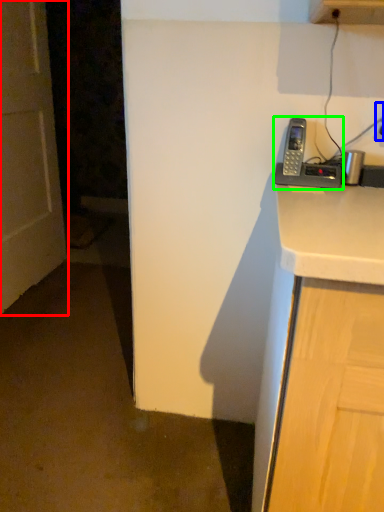
Question: Which is nearer to the door (highlighted by a red box)? electric outlet (highlighted by a blue box) or corded phone (highlighted by a green box).

Choices:
 (A) electric outlet
 (B) corded phone

Answer: (B)